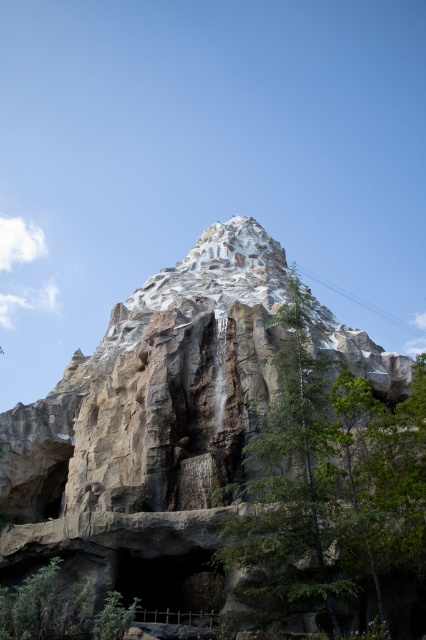
What do you see at coordinates (327, 488) in the screenshot? Image resolution: width=426 pixels, height=640 pixels. I see `green leafy tree at center` at bounding box center [327, 488].

Which is below, green leafy tree at center or green leafy tree at lower left?

green leafy tree at lower left is below.

Is point (284, 310) positioned in front of point (63, 595)?

No.

I want to click on green leafy tree at center, so click(327, 488).

Is rocky cliff at center bigger than green leafy tree at lower left?

Yes, rocky cliff at center is bigger than green leafy tree at lower left.

Between point (160, 452) and point (0, 589), which one is positioned behind?

The point (160, 452) is more distant.

You are a GUI agent. You are given a task and a screenshot of the screen. Output one action in this format:
    pyautogui.click(x=<x>, y=<y>)
    Task: Click on the rocky cliff at center
    This screenshot has width=426, height=640.
    Given the screenshot: What is the action you would take?
    pyautogui.click(x=149, y=428)

In the scene shown: Is rocky cliff at center to the left of green leafy tree at center from the viewer's perspective?

Correct, you'll find rocky cliff at center to the left of green leafy tree at center.

Which is above, rocky cliff at center or green leafy tree at center?

Positioned higher is rocky cliff at center.

The width and height of the screenshot is (426, 640). In order to click on rocky cliff at center in this screenshot , I will do `click(149, 428)`.